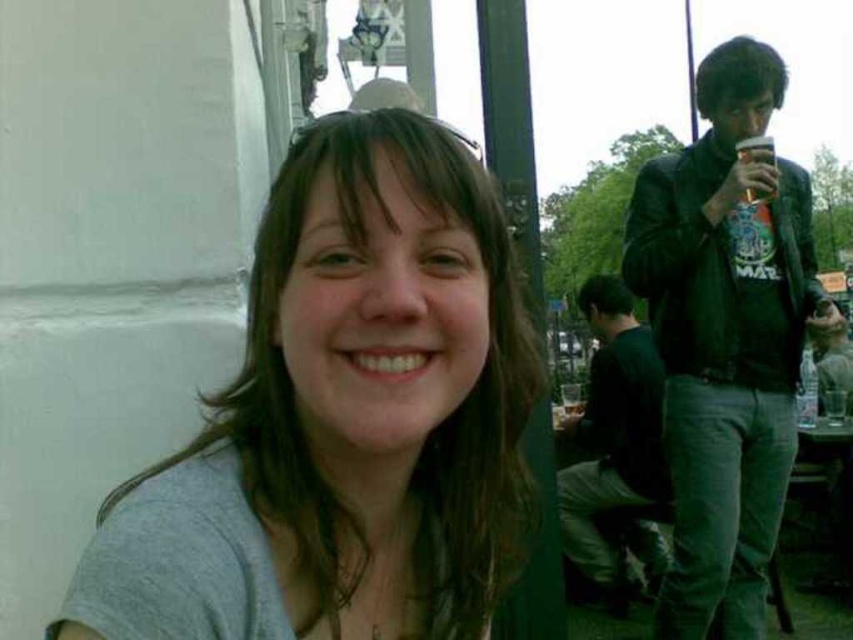
You are a photographer adjusting your camera settings to focus on the person in the image. The gray matte shirt at center is the main subject. The camera can only focus on objects within a 0.1 unit radius around the point specified in the coordinates. Is the gray matte shirt at center within the focus range of the camera set to focus at point (381, 380)?

Yes, the gray matte shirt at center is exactly at the point (381, 380), so it will be in focus since the camera is set to focus at that exact coordinate.

You are a photographer trying to capture a clear shot of the black leather jacket at upper right and the translucent plastic cup at upper right. If you want to ensure both are fully visible in your frame, which object should you prioritize keeping within the camera view?

The black leather jacket at upper right might be wider than the translucent plastic cup at upper right, so you should prioritize keeping the black leather jacket at upper right within the camera view to ensure it fits entirely in the frame.

You are a photographer trying to capture the person in the gray matte shirt at center without including the translucent plastic cup at upper right in the frame. Given their sizes, is this possible?

The gray matte shirt at center is bigger than the translucent plastic cup at upper right, so it is possible to frame the shot to focus on the shirt without including the cup.